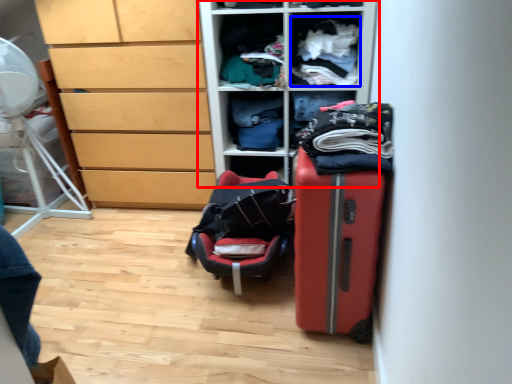
Question: Which of the following is the closest to the observer, furniture (highlighted by a red box) or clothing (highlighted by a blue box)?

Choices:
 (A) furniture
 (B) clothing

Answer: (A)